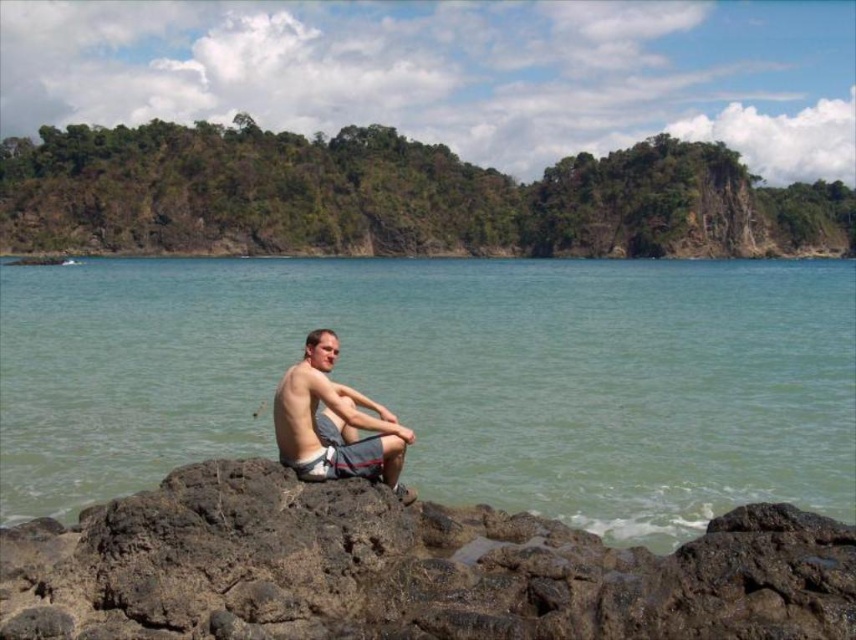
Question: Which of the following is the farthest from the observer?

Choices:
 (A) (444, 545)
 (B) (321, 456)

Answer: (B)

Question: Can you confirm if clear water at center is thinner than brown rough rock at lower center?

Choices:
 (A) yes
 (B) no

Answer: (B)

Question: Which point appears closest to the camera in this image?

Choices:
 (A) (10, 344)
 (B) (699, 609)
 (C) (379, 412)

Answer: (B)

Question: Does clear water at center come in front of brown rough rock at lower center?

Choices:
 (A) no
 (B) yes

Answer: (A)

Question: Can you confirm if clear water at center is bigger than brown rough rock at lower center?

Choices:
 (A) no
 (B) yes

Answer: (B)

Question: Which object appears closest to the camera in this image?

Choices:
 (A) brown rough rock at lower center
 (B) matte gray shorts at center

Answer: (A)